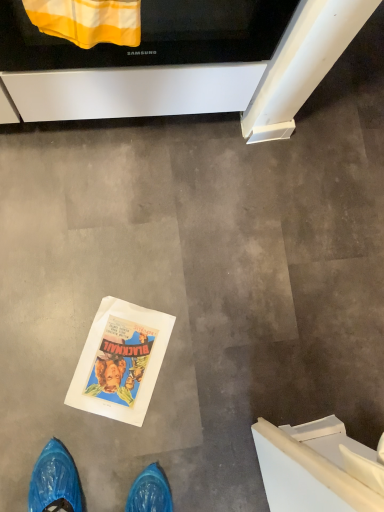
In order to face black glossy oven at upper center, should I rotate leftwards or rightwards?

You should look left and rotate roughly 7.408 degrees.

Measure the distance between black glossy oven at upper center and camera.

A distance of 24.22 inches exists between black glossy oven at upper center and camera.

This screenshot has height=512, width=384. I want to click on black glossy oven at upper center, so click(x=176, y=60).

What is the approximate height of black glossy oven at upper center?

black glossy oven at upper center is 11.84 inches in height.

This screenshot has height=512, width=384. What do you see at coordinates (176, 60) in the screenshot? I see `black glossy oven at upper center` at bounding box center [176, 60].

Find the location of `yellow striped fabric at upper center`. yellow striped fabric at upper center is located at coordinates (88, 20).

Describe the element at coordinates (88, 20) in the screenshot. I see `yellow striped fabric at upper center` at that location.

Image resolution: width=384 pixels, height=512 pixels. I want to click on black glossy oven at upper center, so click(x=176, y=60).

In the image, is yellow striped fabric at upper center on the left side or the right side of black glossy oven at upper center?

yellow striped fabric at upper center is to the left of black glossy oven at upper center.

In the scene shown: Considering their positions, is yellow striped fabric at upper center located in front of or behind black glossy oven at upper center?

Visually, yellow striped fabric at upper center is located in front of black glossy oven at upper center.

Does point (133, 32) come closer to viewer compared to point (148, 54)?

Yes, point (133, 32) is closer to viewer.

From the image's perspective, is yellow striped fabric at upper center beneath black glossy oven at upper center?

Yes, from the image's perspective, yellow striped fabric at upper center is beneath black glossy oven at upper center.

From a real-world perspective, which is physically above, yellow striped fabric at upper center or black glossy oven at upper center?

In real-world perspective, yellow striped fabric at upper center is above.

In the scene shown: Considering the sizes of objects yellow striped fabric at upper center and black glossy oven at upper center in the image provided, who is wider, yellow striped fabric at upper center or black glossy oven at upper center?

Wider between the two is black glossy oven at upper center.

In terms of height, does yellow striped fabric at upper center look taller or shorter compared to black glossy oven at upper center?

Considering their sizes, yellow striped fabric at upper center has less height than black glossy oven at upper center.

Based on their sizes in the image, would you say yellow striped fabric at upper center is bigger or smaller than black glossy oven at upper center?

In the image, yellow striped fabric at upper center appears to be smaller than black glossy oven at upper center.

Would you say yellow striped fabric at upper center is outside black glossy oven at upper center?

Yes, yellow striped fabric at upper center is outside of black glossy oven at upper center.

Are yellow striped fabric at upper center and black glossy oven at upper center located far from each other?

yellow striped fabric at upper center is actually quite close to black glossy oven at upper center.

Is yellow striped fabric at upper center facing towards black glossy oven at upper center?

No, yellow striped fabric at upper center does not turn towards black glossy oven at upper center.

How many degrees apart are the facing directions of yellow striped fabric at upper center and black glossy oven at upper center?

They differ by 0.106 degrees in their facing directions.

Locate an element on the screen. Image resolution: width=384 pixels, height=512 pixels. blanket that appears in front of the black glossy oven at upper center is located at coordinates (88, 20).

Considering the positions of objects black glossy oven at upper center and yellow striped fabric at upper center in the image provided, who is more to the right, black glossy oven at upper center or yellow striped fabric at upper center?

From the viewer's perspective, black glossy oven at upper center appears more on the right side.

Looking at this image, relative to yellow striped fabric at upper center, is black glossy oven at upper center in front or behind?

black glossy oven at upper center is positioned farther from the viewer than yellow striped fabric at upper center.

Which is farther from the camera, (286,3) or (43,30)?

The point (286,3) is more distant.

From the image's perspective, is black glossy oven at upper center located beneath yellow striped fabric at upper center?

No.

From a real-world perspective, who is located lower, black glossy oven at upper center or yellow striped fabric at upper center?

black glossy oven at upper center.

Considering the sizes of objects black glossy oven at upper center and yellow striped fabric at upper center in the image provided, who is thinner, black glossy oven at upper center or yellow striped fabric at upper center?

yellow striped fabric at upper center is thinner.

From the picture: Considering the relative sizes of black glossy oven at upper center and yellow striped fabric at upper center in the image provided, is black glossy oven at upper center taller than yellow striped fabric at upper center?

Indeed, black glossy oven at upper center has a greater height compared to yellow striped fabric at upper center.

Considering the relative sizes of black glossy oven at upper center and yellow striped fabric at upper center in the image provided, is black glossy oven at upper center smaller than yellow striped fabric at upper center?

No, black glossy oven at upper center is not smaller than yellow striped fabric at upper center.

Is black glossy oven at upper center spatially inside yellow striped fabric at upper center, or outside of it?

black glossy oven at upper center is spatially situated outside yellow striped fabric at upper center.

Is the surface of black glossy oven at upper center in direct contact with yellow striped fabric at upper center?

No.

Is black glossy oven at upper center oriented away from yellow striped fabric at upper center?

black glossy oven at upper center is not turned away from yellow striped fabric at upper center.

Identify the location of blanket on the left of black glossy oven at upper center. The image size is (384, 512). (88, 20).

This screenshot has width=384, height=512. In order to click on oven to the right of yellow striped fabric at upper center in this screenshot , I will do `click(176, 60)`.

At what (x,y) coordinates should I click in order to perform the action: click on oven behind the yellow striped fabric at upper center. Please return your answer as a coordinate pair (x, y). This screenshot has height=512, width=384. Looking at the image, I should click on (176, 60).